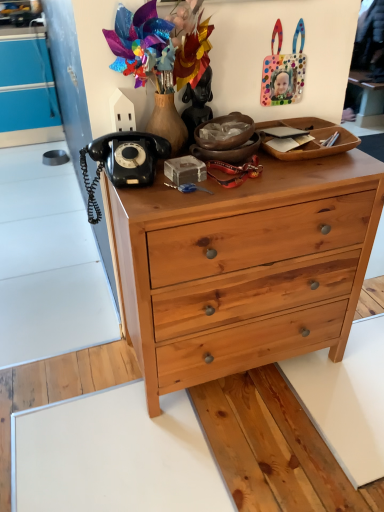
Where is `free space in front of black matte statue at upper center`? free space in front of black matte statue at upper center is located at coordinates (190, 170).